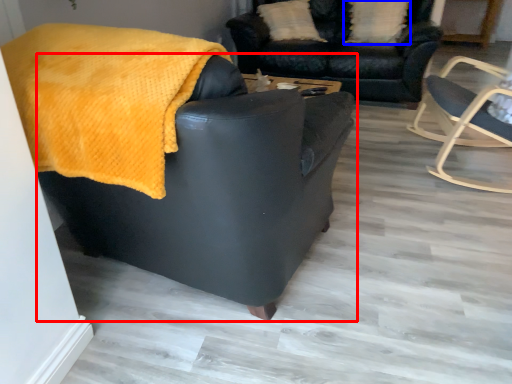
Question: Which object is closer to the camera taking this photo, chair (highlighted by a red box) or pillow (highlighted by a blue box)?

Choices:
 (A) chair
 (B) pillow

Answer: (A)